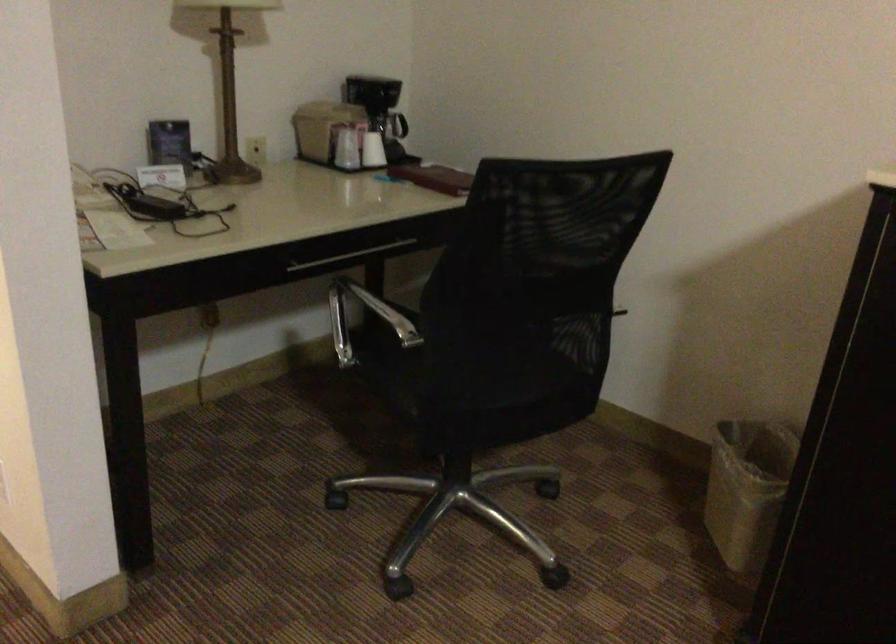
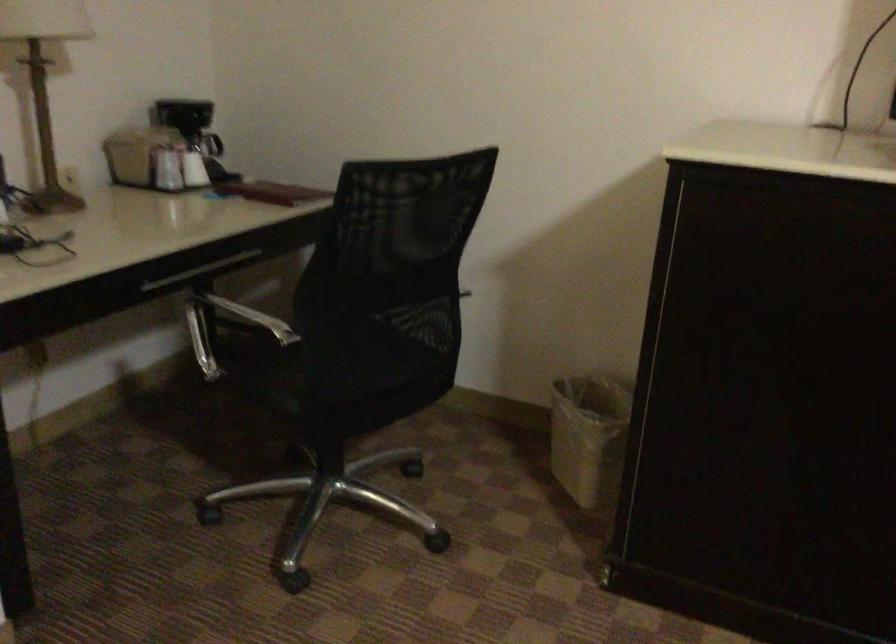
The point at (343, 151) is marked in the first image. Where is the corresponding point in the second image?

(165, 169)